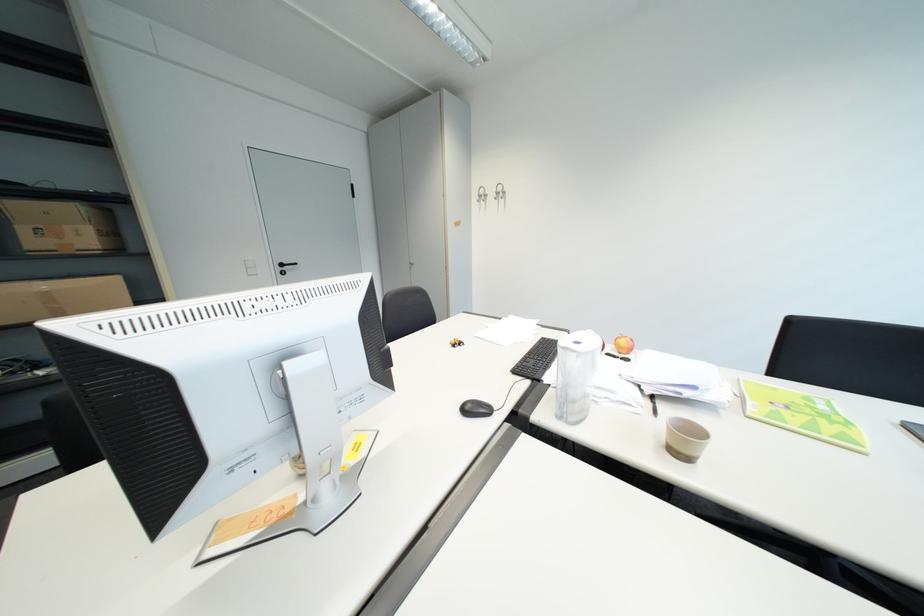
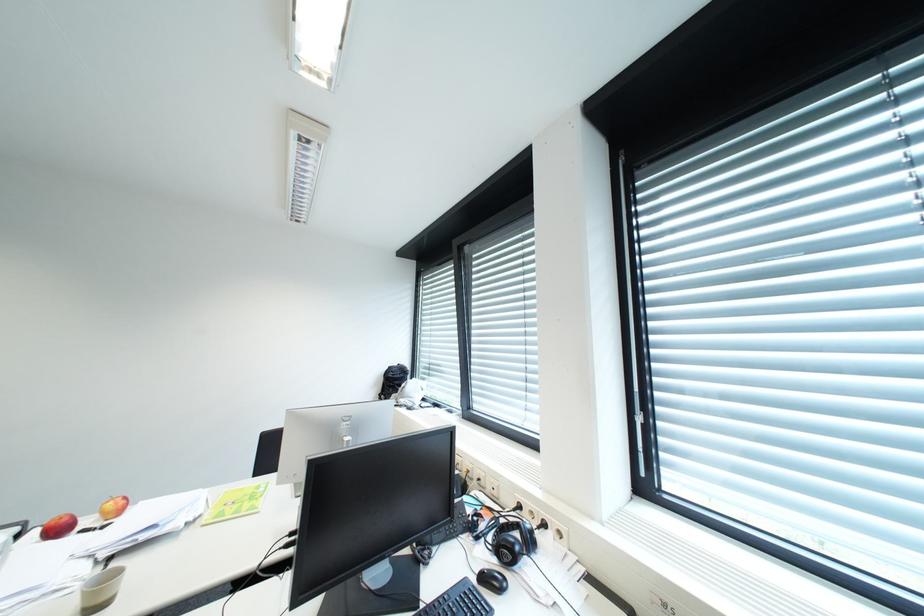
Question: The first image is from the beginning of the video and the second image is from the end. How did the camera likely rotate when shooting the video?

Choices:
 (A) Left
 (B) Right
 (C) Up
 (D) Down

Answer: (B)